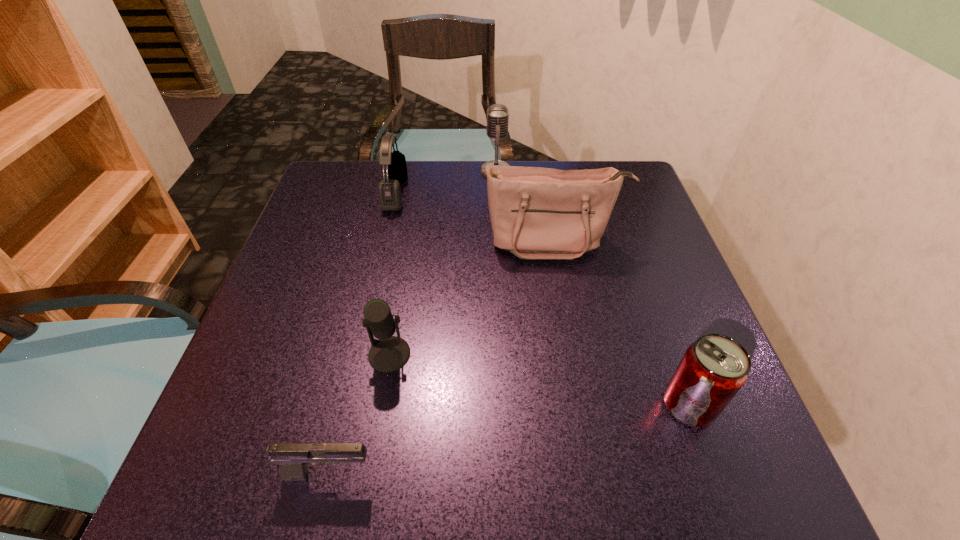
Find the location of a particular element. Image resolution: width=960 pixels, height=540 pixels. the right microphone is located at coordinates (497, 114).

Where is `the farther microphone`? Image resolution: width=960 pixels, height=540 pixels. the farther microphone is located at coordinates (497, 114).

Locate an element on the screen. The height and width of the screenshot is (540, 960). shoulder bag is located at coordinates (536, 213).

Identify the location of headset. This screenshot has height=540, width=960. (390, 196).

Find the location of a particular element. The image size is (960, 540). the left microphone is located at coordinates (389, 353).

The height and width of the screenshot is (540, 960). What are the coordinates of `the fourth farthest object` in the screenshot? It's located at (389, 353).

Where is `pop soda`? pop soda is located at coordinates (714, 368).

Image resolution: width=960 pixels, height=540 pixels. What are the coordinates of `pistol` in the screenshot? It's located at (293, 458).

The height and width of the screenshot is (540, 960). I want to click on the shortest object, so click(x=293, y=458).

Locate an element on the screen. The image size is (960, 540). vacant space located 0.160m on the right of the right microphone is located at coordinates (569, 171).